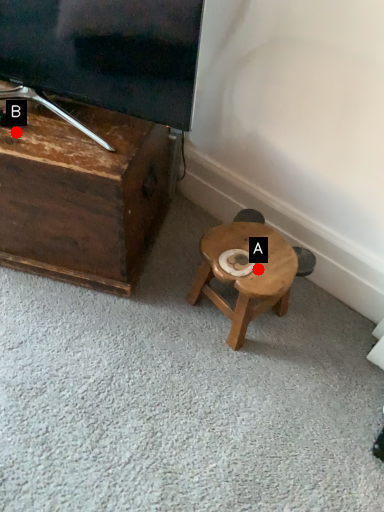
Question: Two points are circled on the image, labeled by A and B beside each circle. Which point appears closest to the camera in this image?

Choices:
 (A) A is closer
 (B) B is closer

Answer: (B)